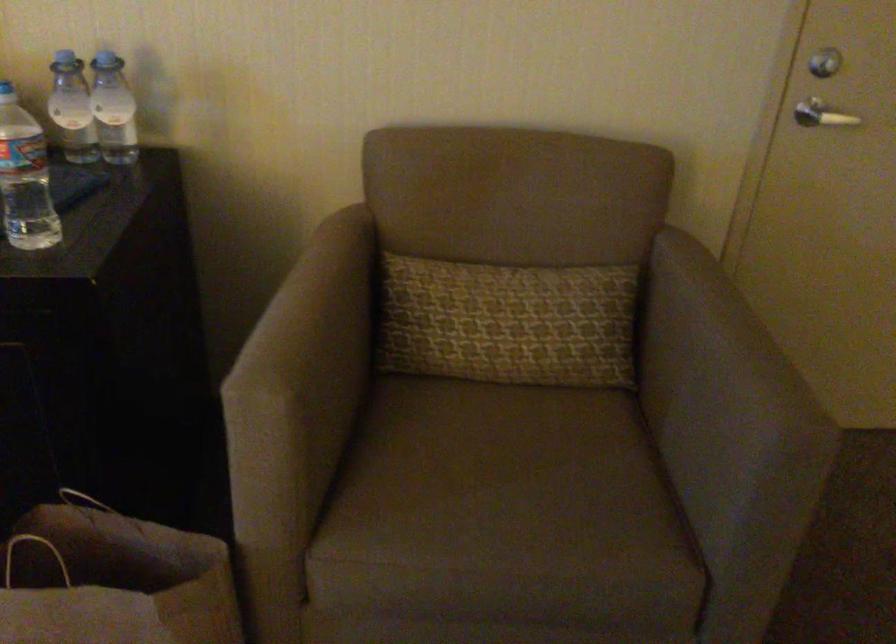
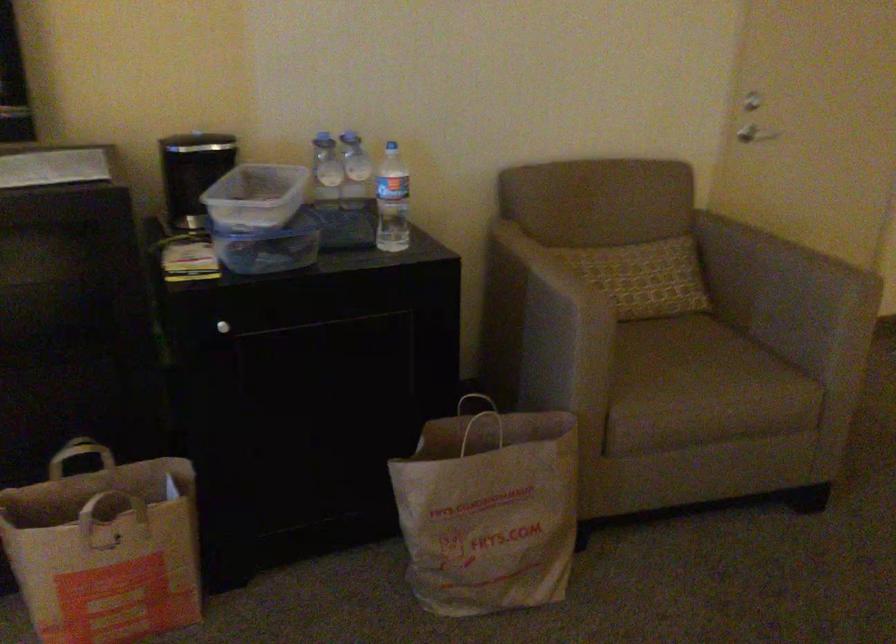
The point at (268, 335) is marked in the first image. Where is the corresponding point in the second image?

(552, 281)